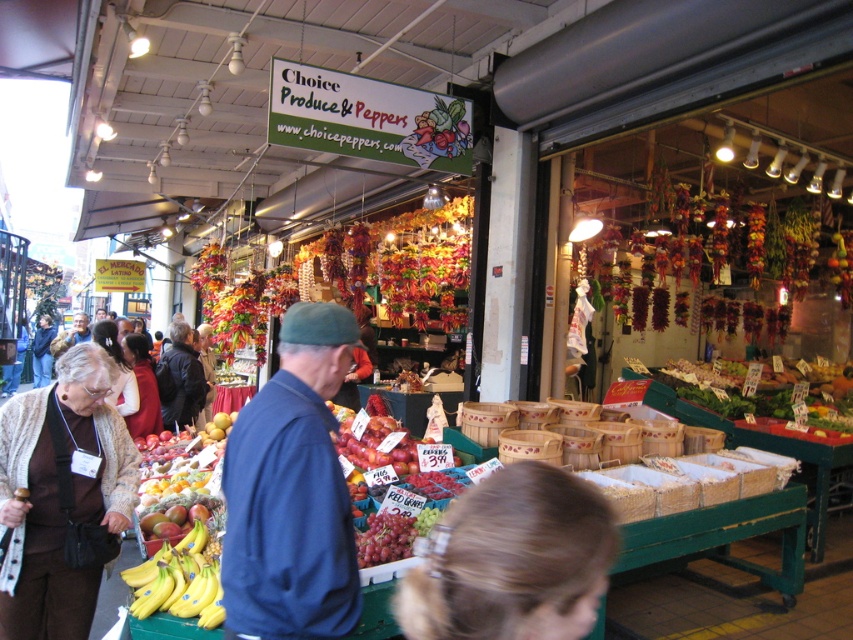
Does matte red sweater at center have a greater width compared to blue denim jacket at center?

No, matte red sweater at center is not wider than blue denim jacket at center.

Who is positioned more to the right, matte red sweater at center or blue denim jacket at center?

matte red sweater at center

Who is more distant from viewer, (138, 392) or (70, 333)?

The point (70, 333) is behind.

Find the location of a particular element. The image size is (853, 640). matte red sweater at center is located at coordinates (142, 387).

Between blonde hair at lower center and blue denim jacket at center, which one is positioned higher?

blue denim jacket at center is higher up.

Who is lower down, blonde hair at lower center or blue denim jacket at center?

Positioned lower is blonde hair at lower center.

This screenshot has height=640, width=853. Describe the element at coordinates (512, 560) in the screenshot. I see `blonde hair at lower center` at that location.

What are the coordinates of `blonde hair at lower center` in the screenshot? It's located at (512, 560).

Who is positioned more to the right, blue fabric jacket at center or blue denim jacket at center?

blue fabric jacket at center is more to the right.

Which is in front, point (288, 321) or point (78, 320)?

Point (288, 321) is in front.

Which is behind, point (258, 458) or point (88, 336)?

Point (88, 336)

Where is `blue fabric jacket at center`? The width and height of the screenshot is (853, 640). blue fabric jacket at center is located at coordinates (291, 492).